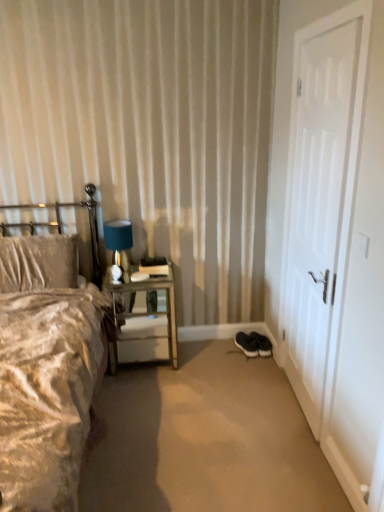
You are a GUI agent. You are given a task and a screenshot of the screen. Output one action in this format:
    pyautogui.click(x=<x>, y=<y>)
    Task: Click on the vacant region to the left of white matte door at right
    The image size is (384, 512).
    Given the screenshot: What is the action you would take?
    pyautogui.click(x=244, y=398)